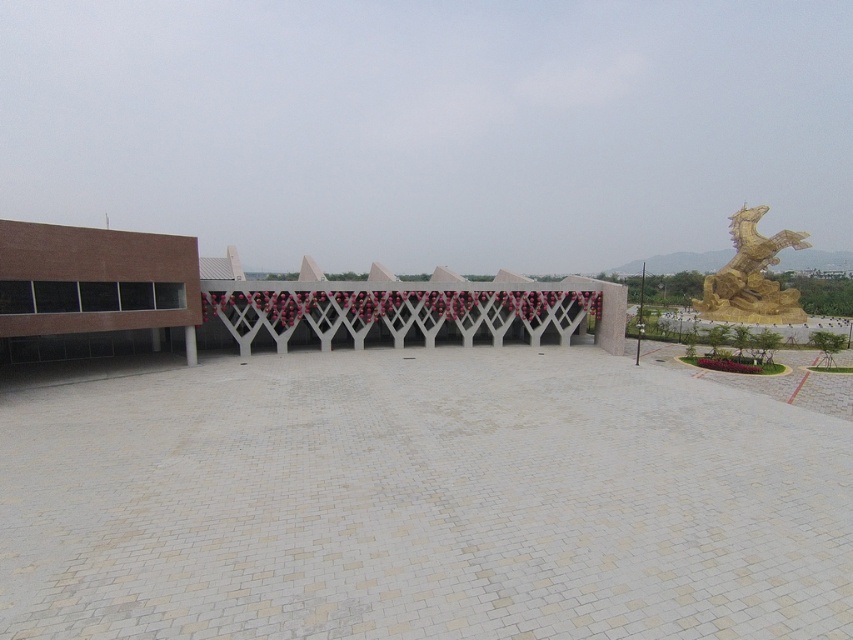
You are a drone operator tasked with capturing aerial footage of the gold metallic dragon at upper right and the white glossy pillar at center. Your drone has a maximum flight range of 50 meters. Can you fly your drone from the dragon to the pillar without exceeding its range?

The gold metallic dragon at upper right is 47.54 meters from the white glossy pillar at center. Since the distance is within the drone operator s 50 meters range, the drone can safely fly from the dragon to the pillar without exceeding its range.

You are standing in the plaza and want to take a photo of the gold metallic dragon at upper right and white glossy pillar at center. Which object is positioned to the right side of the other?

The gold metallic dragon at upper right is to the right of white glossy pillar at center.

You are an architect designing a new sculpture garden. You have two elements to place in the garden layout. The first is the gold metallic dragon at upper right and the second is the white glossy pillar at center. Based on their sizes, which object should be placed closer to the entrance to ensure visitors can easily see both from the entrance?

The gold metallic dragon at upper right should be placed closer to the entrance because it is taller than the white glossy pillar at center, ensuring that both can be seen without one blocking the view of the other.